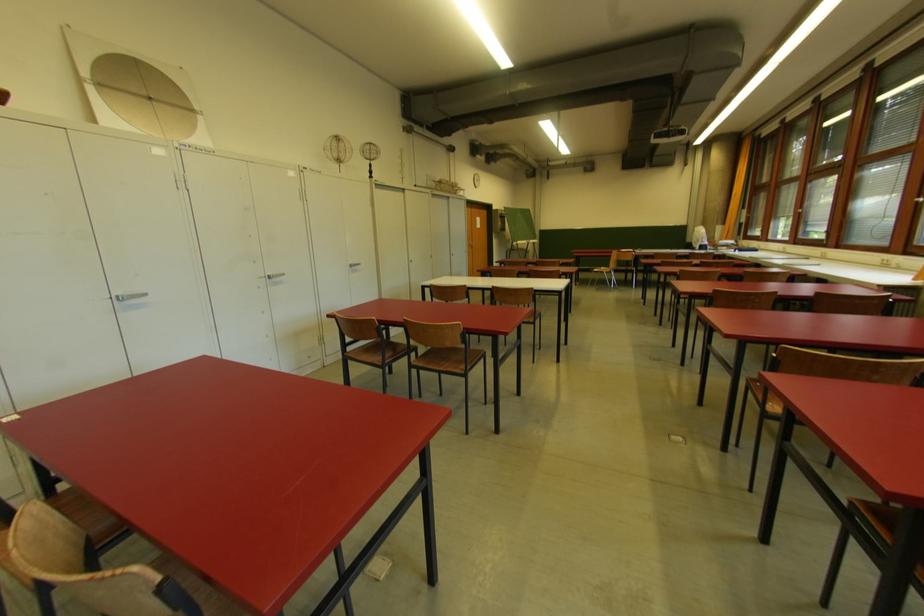
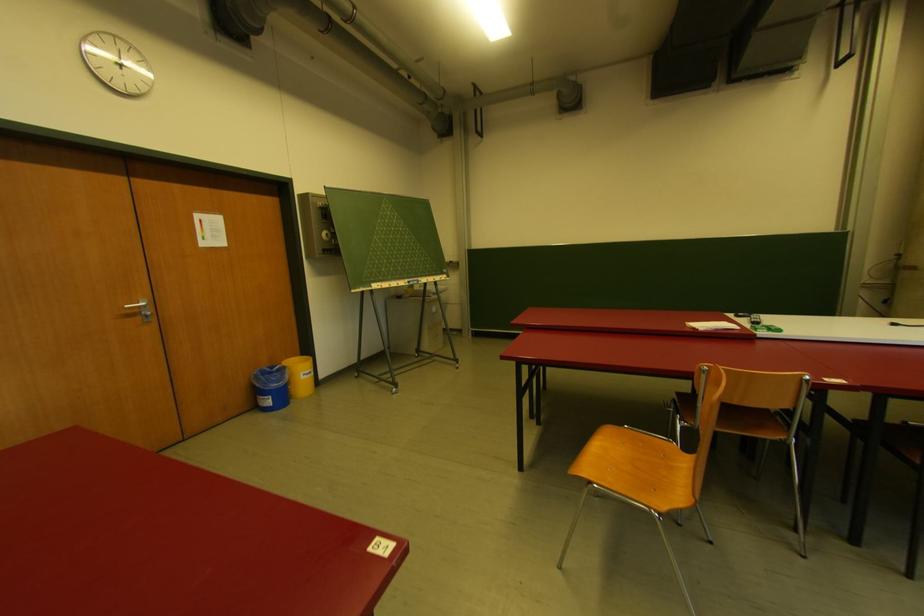
Where in the second image is the point corresponding to point (503, 231) from the first image?

(326, 252)